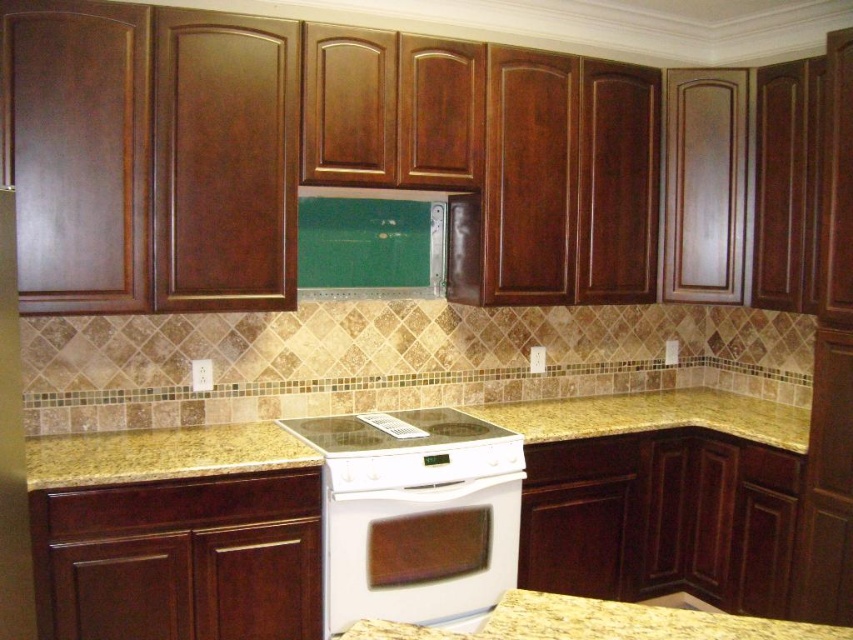
You are a chef preparing a large dish on the white glossy stove at center. You need to place a cutting board on the yellow granite countertop at center next to the stove. Will the countertop be wide enough to accommodate the cutting board?

The yellow granite countertop at center is wider than the white glossy stove at center, so there should be sufficient space to place the cutting board next to the stove.

You are a chef preparing a meal and need to reach the white glossy stove at center. The yellow granite countertop at center is in your way. Can you move around the countertop to access the stove?

The white glossy stove at center is behind the yellow granite countertop at center, so you can move around the countertop to access the stove from behind.

In the scene shown: You are standing in the kitchen and want to reach both the white glossy oven at center and the white glossy stove at center. Which appliance will you need to step forward to access?

You will need to step forward to access the white glossy stove at center because the white glossy oven at center is closer to you, while the stove is further away.